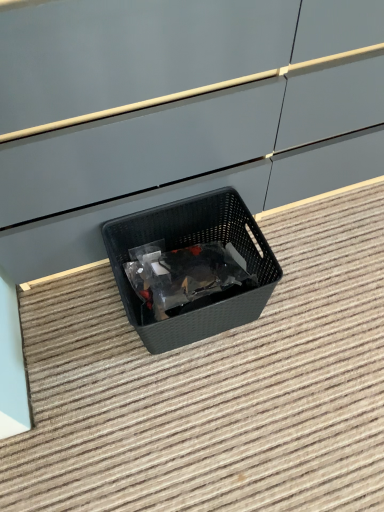
Locate an element on the screen. vacant region to the right of black plastic basket at center is located at coordinates (312, 294).